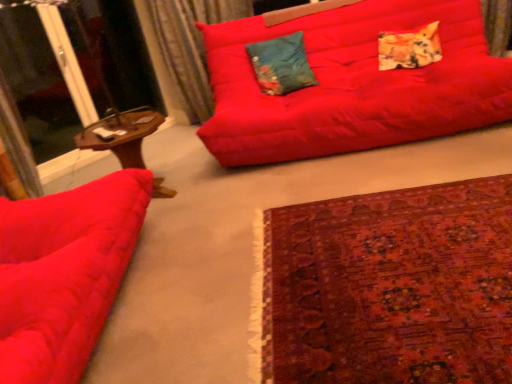
I want to click on free space between woodenwoodentable at left and matte red studio couch at upper center, acting as the first studio couch starting from the back, so click(x=276, y=168).